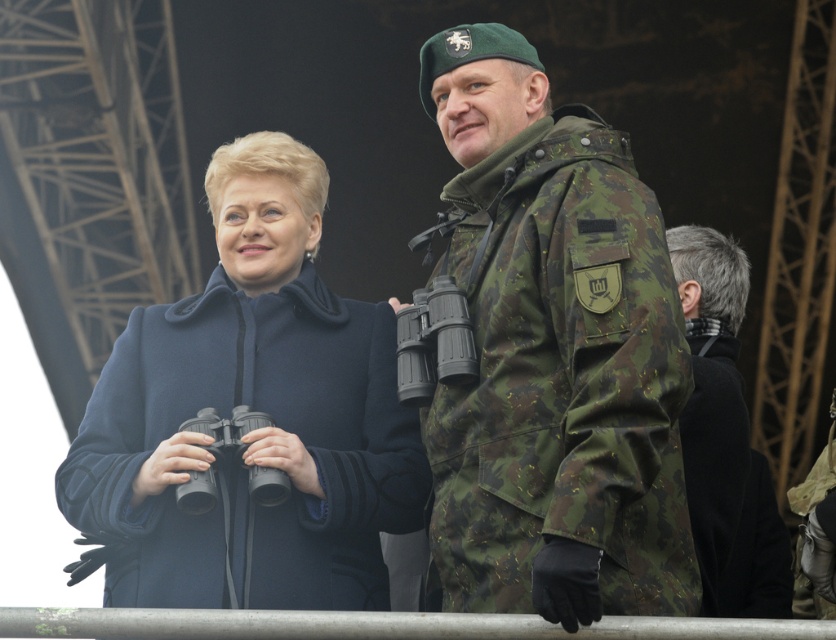
Can you confirm if camo fabric binoculars at right is positioned above dark blue wool coat at center?

No, camo fabric binoculars at right is not above dark blue wool coat at center.

Is camo fabric binoculars at right to the left of dark blue wool coat at center from the viewer's perspective?

Incorrect, camo fabric binoculars at right is not on the left side of dark blue wool coat at center.

Is point (571, 310) farther from viewer compared to point (123, 385)?

No, it is not.

The width and height of the screenshot is (836, 640). Identify the location of camo fabric binoculars at right. (553, 355).

How far apart are dark blue wool coat at center and black wool coat at right?

dark blue wool coat at center and black wool coat at right are 9.02 meters apart.

Is dark blue wool coat at center below black wool coat at right?

Actually, dark blue wool coat at center is above black wool coat at right.

You are a GUI agent. You are given a task and a screenshot of the screen. Output one action in this format:
    pyautogui.click(x=<x>, y=<y>)
    Task: Click on the dark blue wool coat at center
    
    Given the screenshot: What is the action you would take?
    click(x=251, y=408)

In the scene shown: Does camo fabric binoculars at right appear on the left side of black wool coat at right?

Correct, you'll find camo fabric binoculars at right to the left of black wool coat at right.

Based on the photo, is camo fabric binoculars at right above black wool coat at right?

Indeed, camo fabric binoculars at right is positioned over black wool coat at right.

What do you see at coordinates (553, 355) in the screenshot?
I see `camo fabric binoculars at right` at bounding box center [553, 355].

Locate an element on the screen. The width and height of the screenshot is (836, 640). camo fabric binoculars at right is located at coordinates (553, 355).